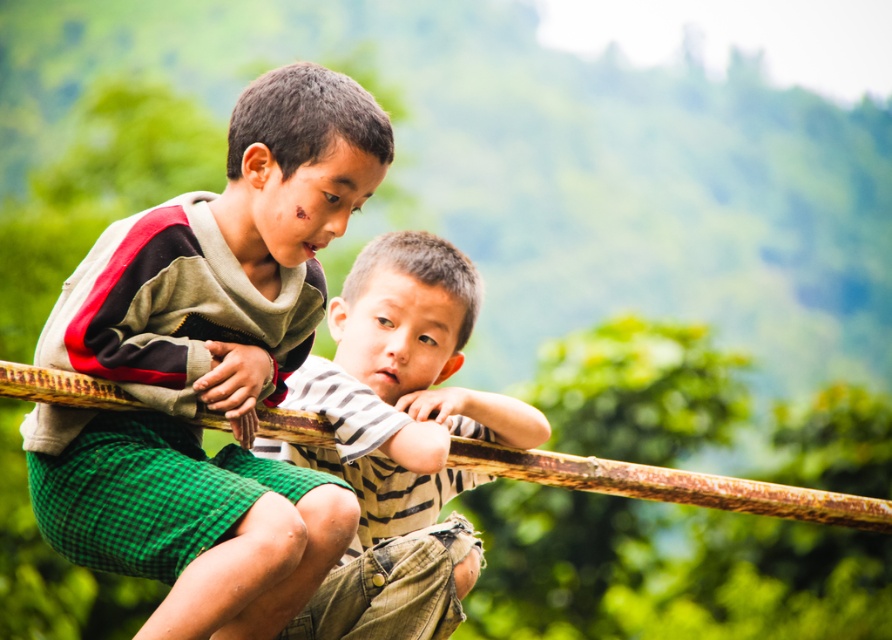
You are a tailor measuring clothing items for alterations. You need to determine which item has a greater width between the green plaid shorts at center and the striped cotton shirt at center. Which one should you measure first?

The green plaid shorts at center has a greater width than the striped cotton shirt at center, so you should measure the green plaid shorts at center first.

You are a photographer trying to capture a candid shot of the two boys sitting on the rustic wooden railing. You want to ensure that both the green plaid shorts at center and the other boy are in focus. Given that your camera has a depth of field range of 5 meters, will you be able to achieve this?

The two boys are 6.82 meters apart, which exceeds the camera depth of field range of 5 meters. Therefore, you cannot have both the green plaid shorts at center and the other boy in focus simultaneously.

You are a photographer trying to capture a closeup of both the green plaid shorts at center and the striped cotton shirt at center. Since you want to focus on the larger item, which one should you adjust your camera to focus on?

The green plaid shorts at center is bigger than the striped cotton shirt at center, so you should focus your camera on the green plaid shorts at center to capture the larger item.